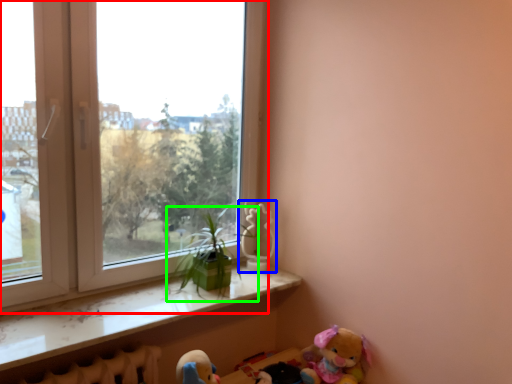
Question: Estimate the real-world distances between objects in this image. Which object is farther from window (highlighted by a red box), toy (highlighted by a blue box) or houseplant (highlighted by a green box)?

Choices:
 (A) toy
 (B) houseplant

Answer: (A)